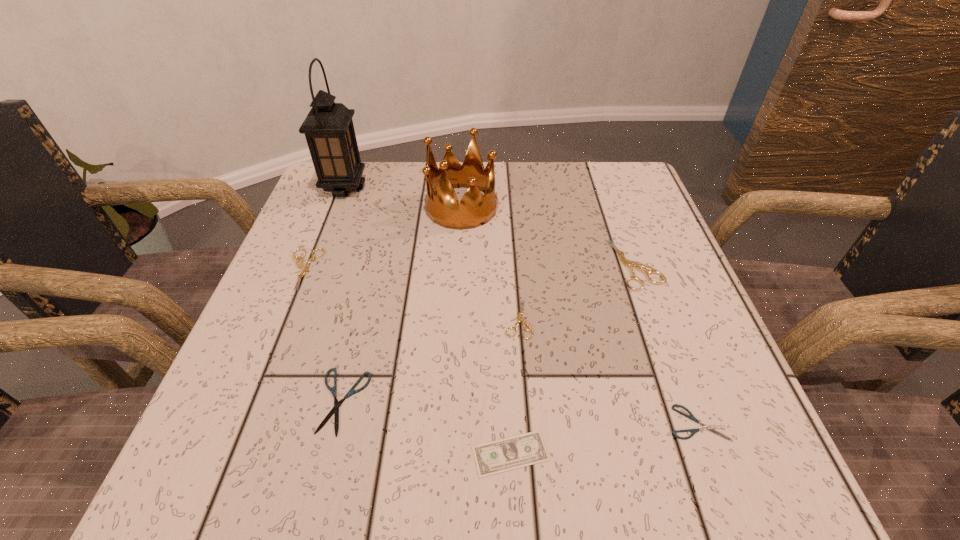
Where is `vacant space located on the right of the bigger black shears`? The width and height of the screenshot is (960, 540). vacant space located on the right of the bigger black shears is located at coordinates (538, 401).

You are a GUI agent. You are given a task and a screenshot of the screen. Output one action in this format:
    pyautogui.click(x=<x>, y=<y>)
    Task: Click on the vacant space located on the left of the shortest shears
    
    Given the screenshot: What is the action you would take?
    pyautogui.click(x=574, y=423)

I want to click on free space located 0.190m on the back of the green money, so click(504, 327).

This screenshot has width=960, height=540. I want to click on lantern that is at the far edge, so click(x=329, y=130).

Locate an element on the screen. This screenshot has width=960, height=540. crown at the far edge is located at coordinates click(x=442, y=206).

Locate an element on the screen. money that is at the near edge is located at coordinates (523, 450).

Find the location of `lantern that is positioned at the left edge`. lantern that is positioned at the left edge is located at coordinates (329, 130).

Where is `object present at the far left corner`? object present at the far left corner is located at coordinates (329, 130).

Find the location of `object at the near left corner`. object at the near left corner is located at coordinates (335, 410).

Identify the location of object present at the near right corner. click(x=704, y=427).